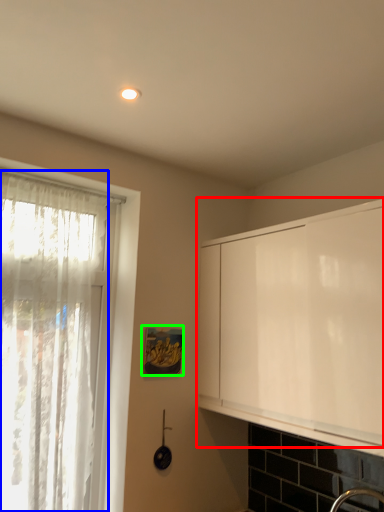
Question: Estimate the real-world distances between objects in this image. Which object is closer to cabinetry (highlighted by a red box), curtain (highlighted by a blue box) or picture frame (highlighted by a green box)?

Choices:
 (A) curtain
 (B) picture frame

Answer: (B)